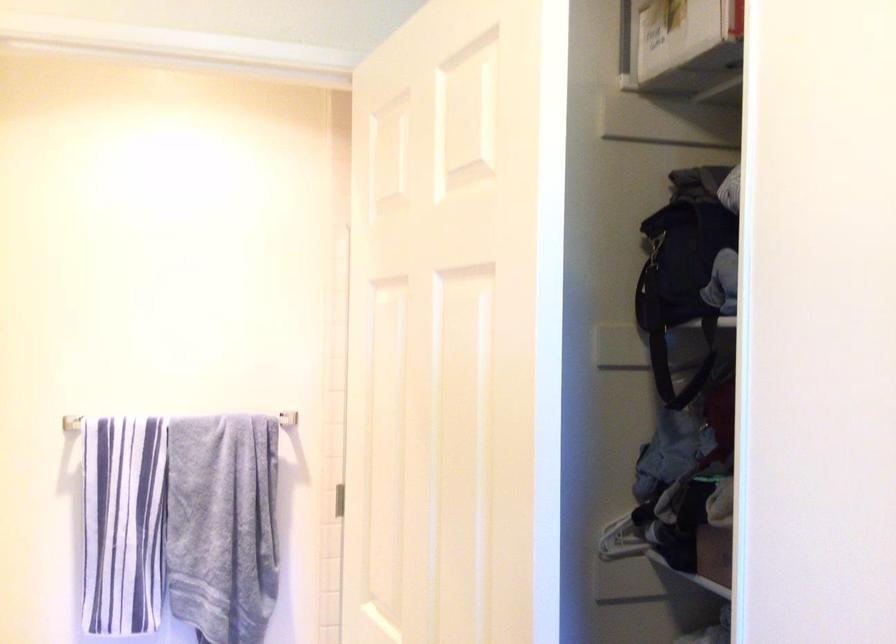
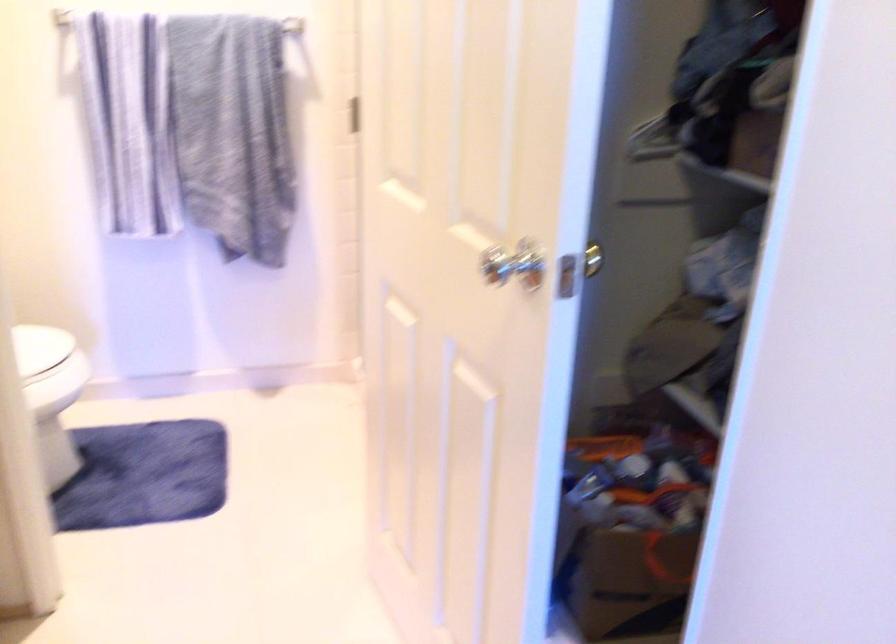
Question: How did the camera likely rotate?

Choices:
 (A) Left
 (B) Right
 (C) Up
 (D) Down

Answer: (D)